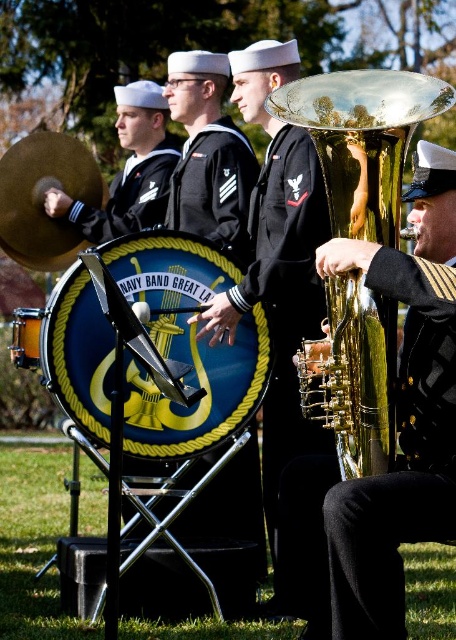
Can you confirm if gold shiny tuba at right is bigger than black fabric uniform at center?

Indeed, gold shiny tuba at right has a larger size compared to black fabric uniform at center.

The height and width of the screenshot is (640, 456). Find the location of `gold shiny tuba at right`. gold shiny tuba at right is located at coordinates (362, 140).

Between dark blue fabric sailor suit at center and orange polished wood drum at center, which one is positioned lower?

orange polished wood drum at center is lower down.

Who is more distant from viewer, (x=135, y=182) or (x=20, y=348)?

Point (x=135, y=182)

Which is behind, point (155, 193) or point (11, 330)?

Point (11, 330)

The width and height of the screenshot is (456, 640). I want to click on dark blue fabric sailor suit at center, so click(x=130, y=196).

Looking at this image, can you confirm if navy blue fabric uniform at center is wider than orange polished wood drum at center?

Yes, navy blue fabric uniform at center is wider than orange polished wood drum at center.

Based on the photo, who is positioned more to the left, navy blue fabric uniform at center or orange polished wood drum at center?

Positioned to the left is orange polished wood drum at center.

The width and height of the screenshot is (456, 640). Find the location of `navy blue fabric uniform at center`. navy blue fabric uniform at center is located at coordinates (214, 188).